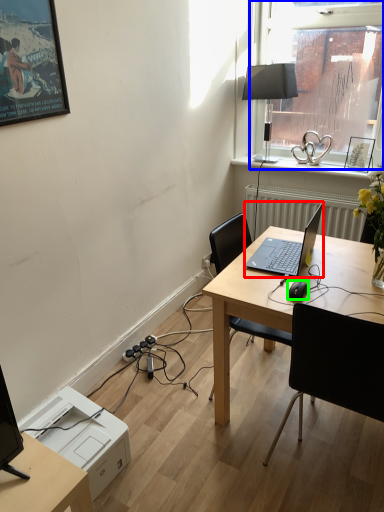
Question: Considering the real-world distances, which object is farthest from laptop (highlighted by a red box)? window (highlighted by a blue box) or computer mouse (highlighted by a green box)?

Choices:
 (A) window
 (B) computer mouse

Answer: (A)